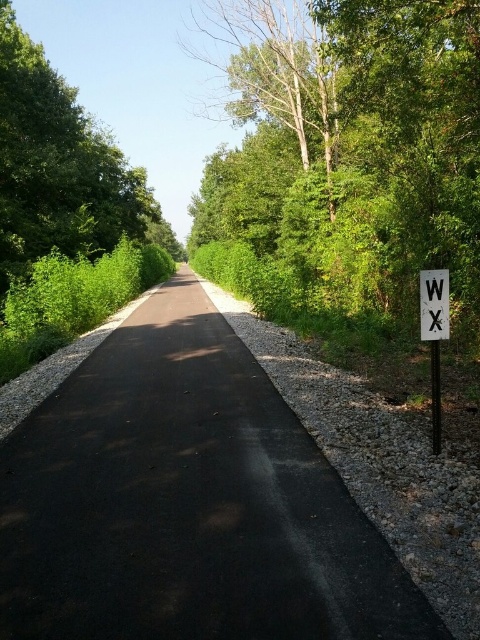
Question: Which point is closer to the camera?

Choices:
 (A) white plastic sign at right
 (B) white wooden sign at right
 (C) green leafy tree at center

Answer: (B)

Question: Which point is farther from the camera taking this photo?

Choices:
 (A) (47, 227)
 (B) (441, 324)

Answer: (A)

Question: Among these points, which one is farthest from the camera?

Choices:
 (A) (362, 538)
 (B) (432, 413)

Answer: (B)

Question: Can you confirm if black asphalt path at center is smaller than green leafy tree at center?

Choices:
 (A) no
 (B) yes

Answer: (B)

Question: Does green leafy tree at center appear on the left side of white wooden sign at right?

Choices:
 (A) no
 (B) yes

Answer: (B)

Question: Is green leafy tree at center positioned in front of white plastic sign at right?

Choices:
 (A) yes
 (B) no

Answer: (B)